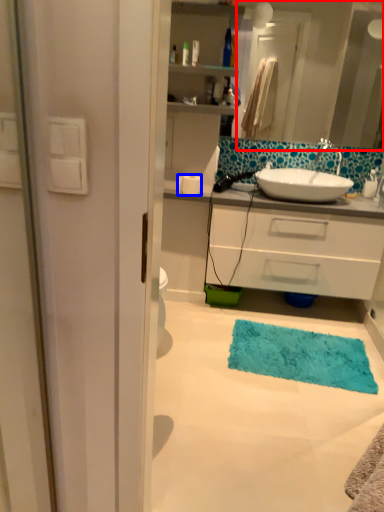
Question: Which object appears farthest to the camera in this image, mirror (highlighted by a red box) or toilet paper (highlighted by a blue box)?

Choices:
 (A) mirror
 (B) toilet paper

Answer: (B)